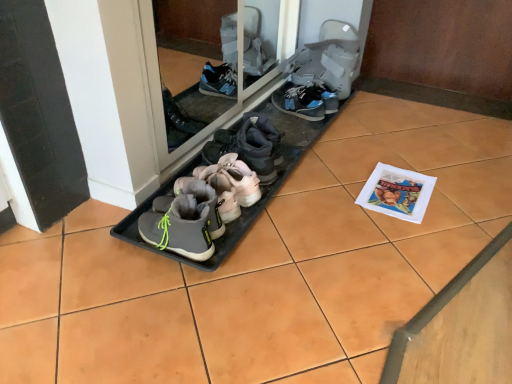
Question: In terms of width, does gray suede booties at center, acting as the 1th footwear starting from the front, look wider or thinner when compared to gray fabric boot at center, acting as the 7th footwear starting from the front?

Choices:
 (A) wide
 (B) thin

Answer: (B)

Question: Visually, is gray suede booties at center, acting as the seventh footwear starting from the back, positioned to the left or to the right of gray fabric boot at center, acting as the 7th footwear starting from the front?

Choices:
 (A) right
 (B) left

Answer: (B)

Question: Estimate the real-world distances between objects in this image. Which object is closer to the gray suede sneaker at center, which appears as the second footwear when viewed from the back?

Choices:
 (A) white paper magazine at upper right
 (B) gray suede booties at center, acting as the seventh footwear starting from the back
 (C) gray suede sneakers at center, positioned as the third footwear in back-to-front order
 (D) gray fabric sneakers at center, positioned as the 4th footwear in back-to-front order
 (E) transparent glass door at center

Answer: (C)

Question: Which object is positioned closest to the gray suede sneaker at center, positioned as the sixth footwear in front-to-back order?

Choices:
 (A) gray fabric boot at center, acting as the 7th footwear starting from the front
 (B) gray suede sneakers at center, positioned as the third footwear in back-to-front order
 (C) gray rubber boots at center, which appears as the 2th footwear when viewed from the front
 (D) transparent glass door at center
 (E) white paper magazine at upper right

Answer: (A)